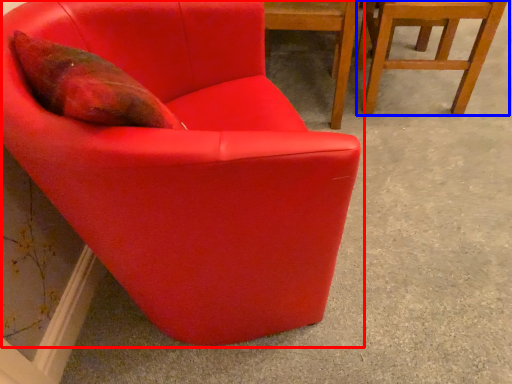
Question: Which point is further to the camera, chair (highlighted by a red box) or chair (highlighted by a blue box)?

Choices:
 (A) chair
 (B) chair

Answer: (B)